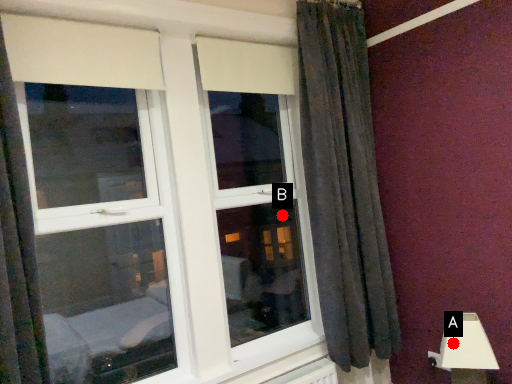
Question: Two points are circled on the image, labeled by A and B beside each circle. Which point is closer to the camera?

Choices:
 (A) A is closer
 (B) B is closer

Answer: (A)